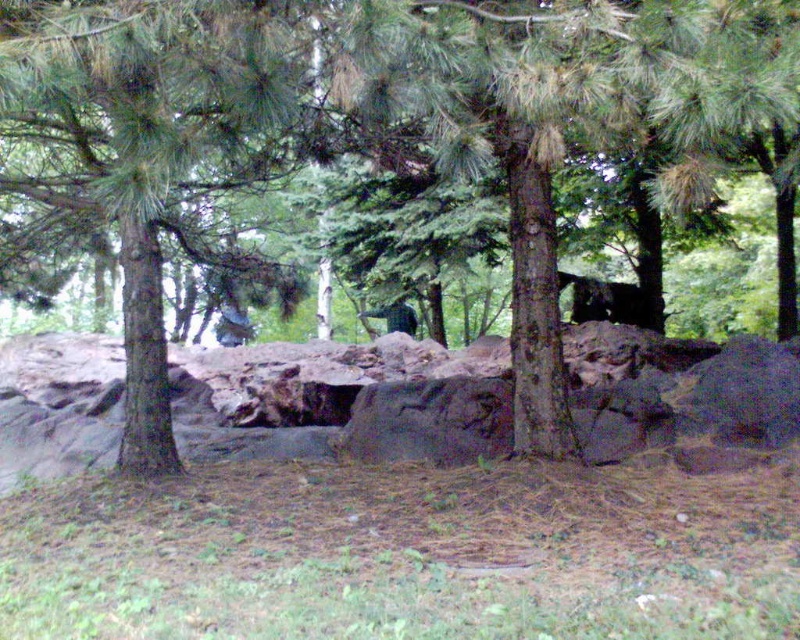
You are a small bird looking for a place to perch. You see the brown rough tree at center and the green matte bird at center. Which object is larger and would provide a sturdier perch?

The brown rough tree at center is bigger than the green matte bird at center, so it would provide a sturdier perch.

A photographer wants to take a picture of the black furry bear at center. The camera has a focal length of 50mm and is set to a 1.5x crop factor. If the photographer is standing at point A, which is located at coordinates 0.3, 0.6, will the bear be in the center of the photo? Please explain using the coordinates provided.

The black furry bear at center is located at coordinates (x=608, y=301). The photographer is at point A at (x=480, y=192). Since the coordinates differ, the bear will not be centered in the photo unless the photographer adjusts their position or angle to align with the bear.

You are a hiker who wants to take a photo of the brown rough tree at center and the black furry bear at center. Since you have a camera with a fixed focal length, you need to adjust your position so both objects are in frame. Considering their sizes, which object should you move closer to in order to include both in your photo?

The brown rough tree at center is larger than the black furry bear at center. To include both in the frame, you should move closer to the black furry bear at center so that the larger tree doesn